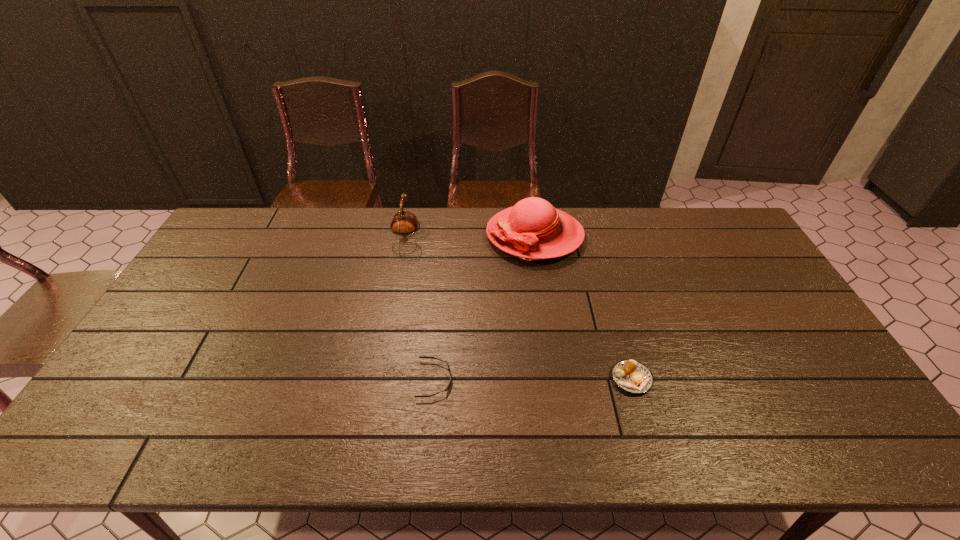
At what (x,y) coordinates should I click in order to perform the action: click on the tallest object. Please return your answer as a coordinate pair (x, y). Image resolution: width=960 pixels, height=540 pixels. Looking at the image, I should click on (533, 229).

The width and height of the screenshot is (960, 540). I want to click on telephone, so click(403, 222).

This screenshot has width=960, height=540. I want to click on the third shortest object, so click(x=403, y=222).

This screenshot has width=960, height=540. Find the location of `the second shortest object`. the second shortest object is located at coordinates (633, 377).

You are a GUI agent. You are given a task and a screenshot of the screen. Output one action in this format:
    pyautogui.click(x=<x>, y=<y>)
    Task: Click on the sunglasses
    This screenshot has width=960, height=540.
    Given the screenshot: What is the action you would take?
    pyautogui.click(x=449, y=384)

Find the location of a particular element. The width and height of the screenshot is (960, 540). the third object from right to left is located at coordinates pyautogui.click(x=449, y=384).

The image size is (960, 540). I want to click on free spot located 0.240m at the front of the hat with a bow, so click(418, 235).

The width and height of the screenshot is (960, 540). I want to click on free region located 0.080m at the front of the hat with a bow, so click(x=463, y=235).

Find the location of a particular element. free region located at the front of the hat with a bow is located at coordinates (426, 235).

What are the coordinates of `vacant space located 0.400m on the rotary dial of the third shortest object` in the screenshot? It's located at (542, 237).